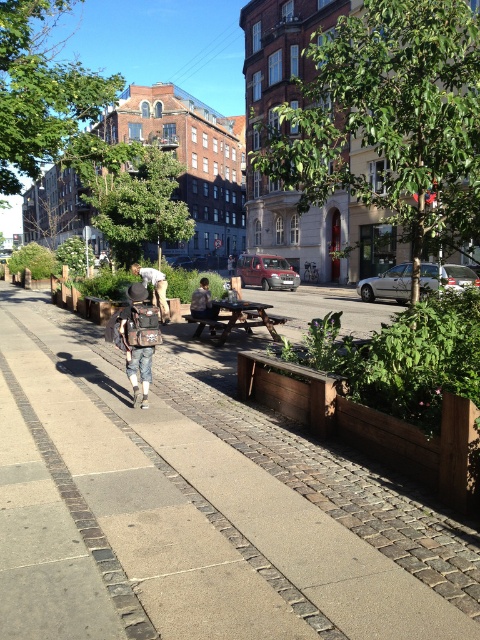
Question: Based on their relative distances, which object is nearer to the dark blue jeans at center?

Choices:
 (A) light brown leather jacket at center
 (B) denim jacket at center

Answer: (A)

Question: Considering the real-world distances, which object is farthest from the denim jacket at center?

Choices:
 (A) dark blue jeans at center
 (B) wooden picnic table at center
 (C) light brown leather jacket at center
 (D) brown wooden pavement at center

Answer: (C)

Question: Can you confirm if brown wooden pavement at center is bigger than wooden picnic table at center?

Choices:
 (A) yes
 (B) no

Answer: (A)

Question: Is brown wooden pavement at center further to the viewer compared to light brown leather jacket at center?

Choices:
 (A) no
 (B) yes

Answer: (A)

Question: Which object is farther from the camera taking this photo?

Choices:
 (A) wooden picnic table at center
 (B) brown wooden pavement at center
 (C) dark blue jeans at center

Answer: (C)

Question: Is denim jacket at center wider than wooden picnic table at center?

Choices:
 (A) no
 (B) yes

Answer: (A)